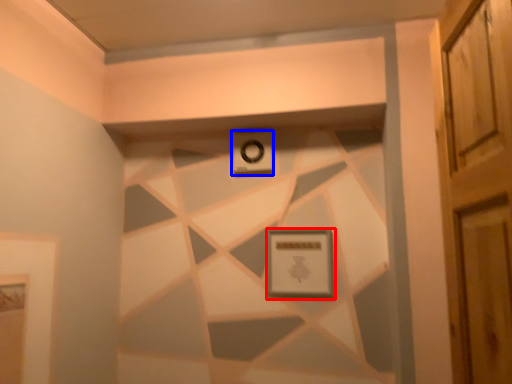
Question: Which object appears closest to the camera in this image, picture frame (highlighted by a red box) or alarm (highlighted by a blue box)?

Choices:
 (A) picture frame
 (B) alarm

Answer: (A)